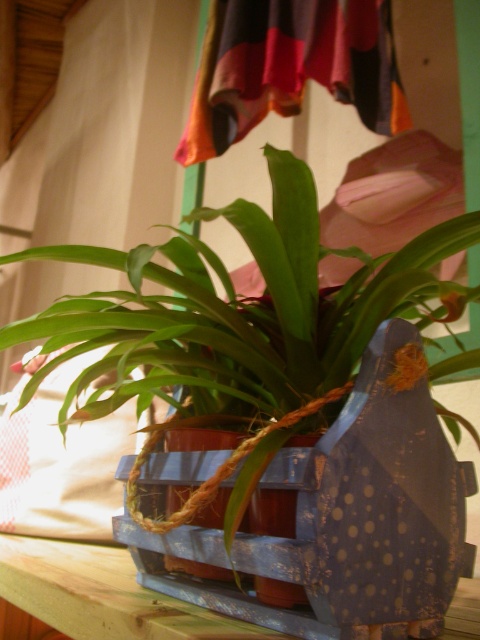
Question: Is green matte plant at center bigger than wooden at lower left?

Choices:
 (A) no
 (B) yes

Answer: (B)

Question: Among these objects, which one is nearest to the camera?

Choices:
 (A) wooden at lower left
 (B) green matte plant at center

Answer: (B)

Question: Is green matte plant at center to the right of wooden at lower left from the viewer's perspective?

Choices:
 (A) yes
 (B) no

Answer: (A)

Question: Where is green matte plant at center located in relation to wooden at lower left in the image?

Choices:
 (A) above
 (B) below

Answer: (A)

Question: Among these points, which one is farthest from the camera?

Choices:
 (A) (147, 632)
 (B) (383, 280)

Answer: (B)

Question: Among these points, which one is nearest to the camera?

Choices:
 (A) (20, 593)
 (B) (355, 292)

Answer: (B)